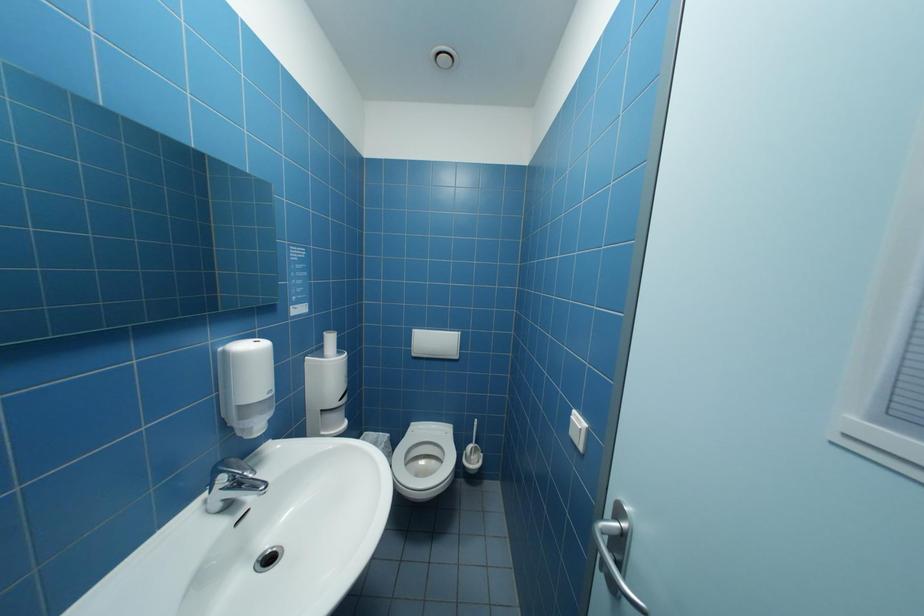
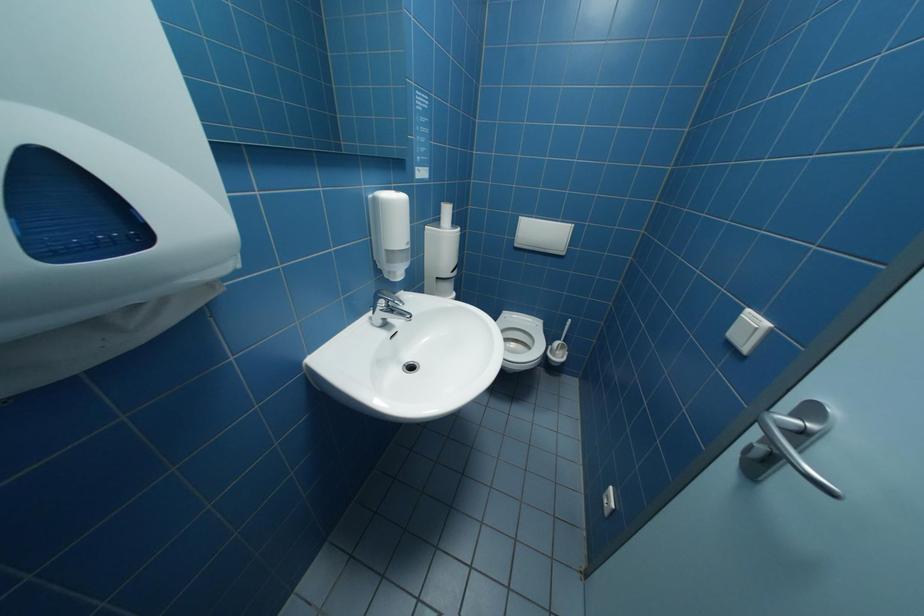
Question: In a continuous first-person perspective shot, in which direction is the camera moving?

Choices:
 (A) Left
 (B) Right
 (C) Forward
 (D) Backward

Answer: (A)